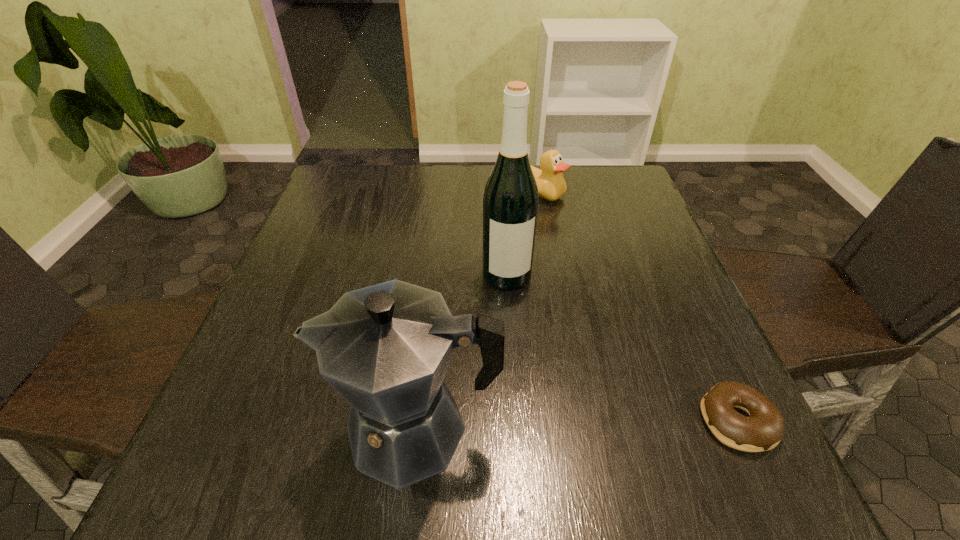
This screenshot has width=960, height=540. I want to click on coffeepot, so click(385, 349).

Where is `the rightmost object`? The height and width of the screenshot is (540, 960). the rightmost object is located at coordinates (763, 429).

At what (x,y) coordinates should I click in order to perform the action: click on doughnut. Please return your answer as a coordinate pair (x, y). Looking at the image, I should click on (763, 429).

At what (x,y) coordinates should I click in order to perform the action: click on the second farthest object. Please return your answer as a coordinate pair (x, y). Looking at the image, I should click on (510, 202).

The image size is (960, 540). Identify the location of wine bottle. (510, 202).

The image size is (960, 540). What are the coordinates of `the third tallest object` in the screenshot? It's located at (551, 184).

The height and width of the screenshot is (540, 960). Identify the location of duck. (551, 184).

What are the coordinates of `vacant space located at the spout of the coffeepot` in the screenshot? It's located at (228, 428).

Locate an element on the screen. free spot located at the spout of the coffeepot is located at coordinates (284, 428).

Where is `vacant space located 0.070m at the spout of the coffeepot`? The width and height of the screenshot is (960, 540). vacant space located 0.070m at the spout of the coffeepot is located at coordinates (290, 428).